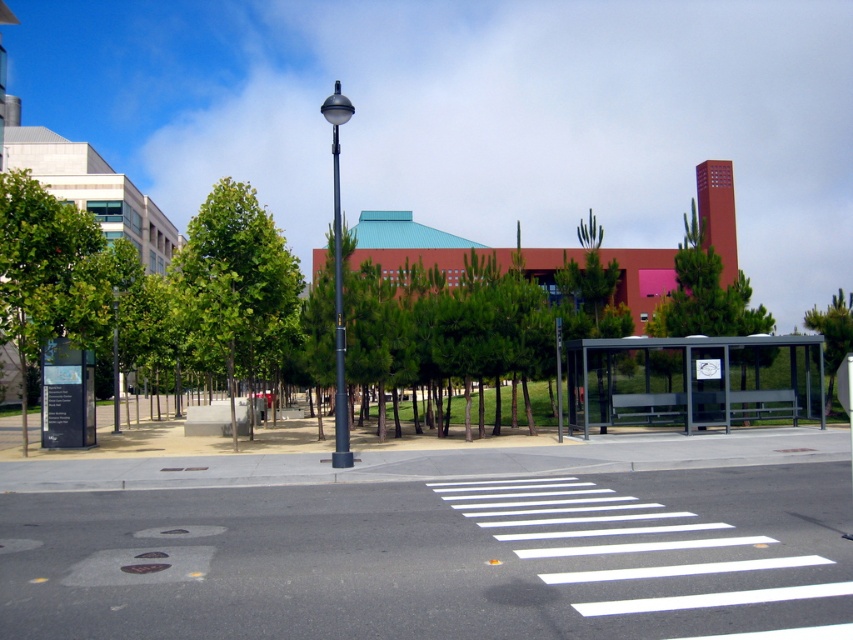
Can you confirm if metallic gray bus stop at center right is shorter than green leafy tree at left?

Indeed, metallic gray bus stop at center right has a lesser height compared to green leafy tree at left.

Image resolution: width=853 pixels, height=640 pixels. I want to click on metallic gray bus stop at center right, so click(693, 380).

Locate an element on the screen. This screenshot has height=640, width=853. metallic gray bus stop at center right is located at coordinates (693, 380).

Does metallic gray bus stop at center right lie behind green leafy tree at upper right?

Yes, metallic gray bus stop at center right is further from the viewer.

Which of these two, metallic gray bus stop at center right or green leafy tree at upper right, stands shorter?

With less height is metallic gray bus stop at center right.

Is point (772, 371) positioned after point (814, 308)?

No, it is not.

Where is `metallic gray bus stop at center right`? metallic gray bus stop at center right is located at coordinates coord(693,380).

Does point (253, 369) come farther from viewer compared to point (334, 129)?

That is True.

In the scene shown: Between green leafy tree at left and polished metal streetlight at center-left, which one has more height?

polished metal streetlight at center-left

Is point (271, 284) more distant than point (334, 180)?

Yes.

Image resolution: width=853 pixels, height=640 pixels. What are the coordinates of `green leafy tree at left` in the screenshot? It's located at (235, 282).